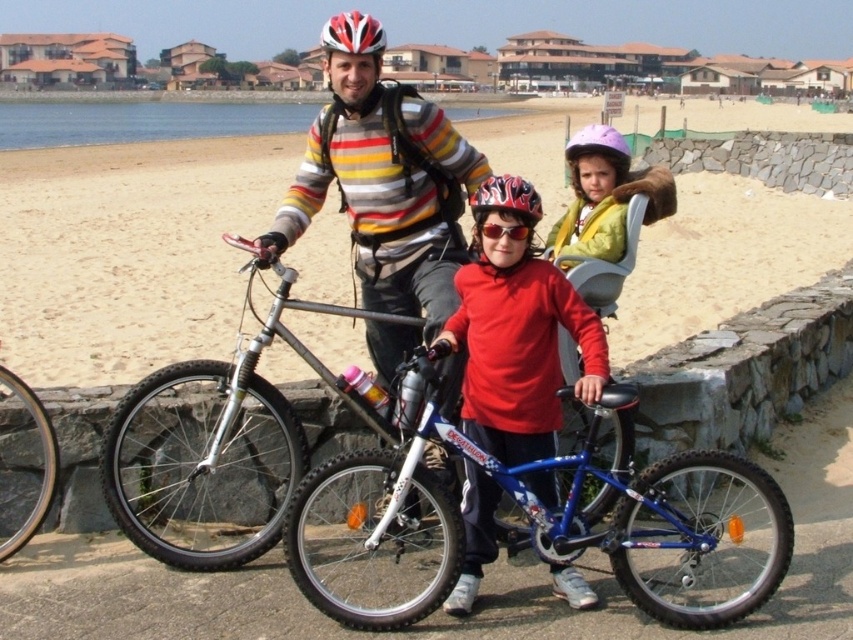
You are standing at the point marked by the coordinates (544, 522) in the image. What object are you standing on?

The point at coordinates (544, 522) corresponds to the blue metallic bicycle at center.

You are a photographer trying to capture a candid shot of the purple matte helmet at center without including the blue metallic bicycle at center in the frame. Based on their positions, is this possible? Explain your reasoning.

The blue metallic bicycle at center is to the left of the purple matte helmet at center. Since the bicycle is positioned to the left of the helmet, you can angle the camera to the right side of the helmet to avoid capturing the bicycle in the frame.

You are a photographer trying to capture a clear shot of the silver metallic bicycle at center and the purple matte helmet at center. Since you want to focus on the bicycle, should you adjust your camera to focus on the object that is closer to you?

Yes, you should focus on the silver metallic bicycle at center because it is closer to you than the purple matte helmet at center, so focusing on the closer object ensures the bicycle remains sharp in the photo.